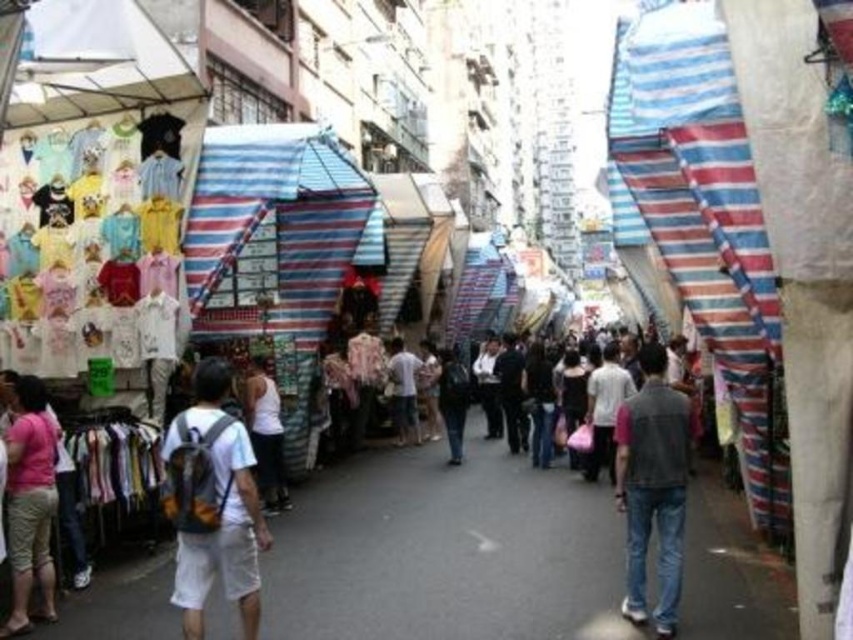
You are a customer at the market and want to buy both the white fabric backpack at center and the white matte tank top at center. However, you have a limited budget and can only afford one item. Which item is closer to you so you can reach it quickly?

Both items are at the center, so they are equally close to you.

You are standing in the middle of the market street and see two points marked in the scene. Which point is closer to you? The points are labeled as point 1 at coordinates point (27, 504) and point 2 at coordinates point (276, 474).

Point 1 at coordinates point (27, 504) is closer to you because it is in front of point 2 at coordinates point (276, 474).